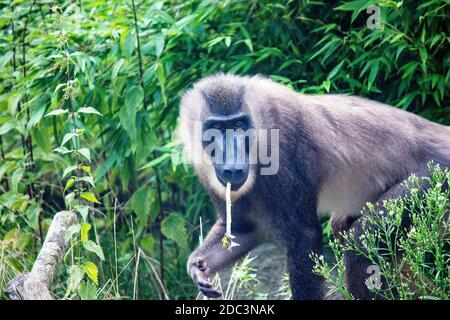
This screenshot has width=450, height=320. I want to click on green plants, so (84, 109), (39, 115), (195, 50), (225, 40), (394, 54), (398, 44), (327, 32), (94, 10), (24, 123).